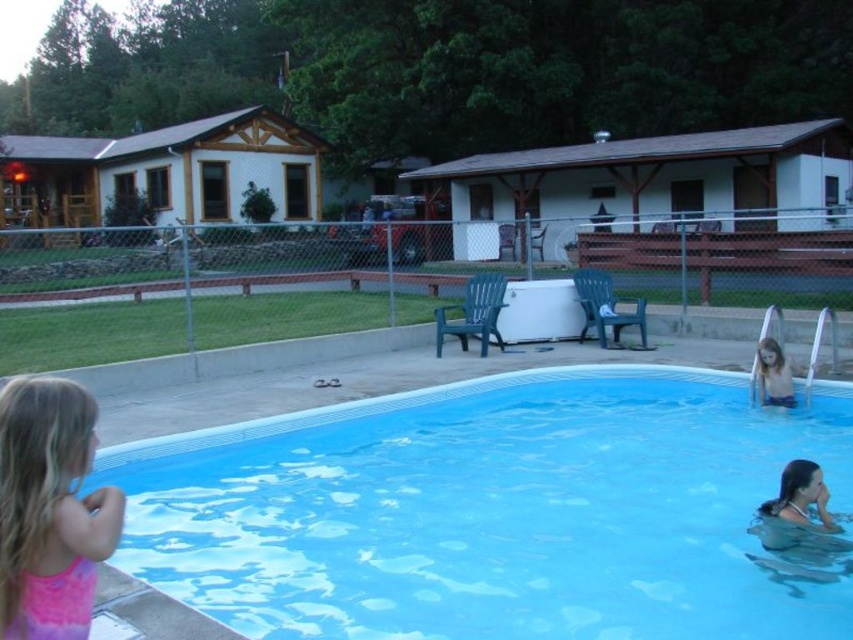
Can you confirm if blue smooth pool at lower center is wider than pink fabric dress at lower left?

Indeed, blue smooth pool at lower center has a greater width compared to pink fabric dress at lower left.

Does blue smooth pool at lower center appear on the right side of pink fabric dress at lower left?

Indeed, blue smooth pool at lower center is positioned on the right side of pink fabric dress at lower left.

Between point (602, 436) and point (59, 637), which one is positioned behind?

The point (602, 436) is behind.

Find the location of a particular element. blue smooth pool at lower center is located at coordinates (489, 512).

Can you confirm if blue smooth pool at lower center is positioned to the right of smooth skin child at lower right?

In fact, blue smooth pool at lower center is to the left of smooth skin child at lower right.

Is point (683, 381) in front of point (780, 387)?

No, (683, 381) is further to viewer.

Locate an element on the screen. This screenshot has height=640, width=853. blue smooth pool at lower center is located at coordinates (489, 512).

Locate an element on the screen. Image resolution: width=853 pixels, height=640 pixels. blue smooth pool at lower center is located at coordinates (489, 512).

Which is more to the left, pink fabric dress at lower left or smooth skin child at lower right?

Positioned to the left is pink fabric dress at lower left.

Does pink fabric dress at lower left have a lesser height compared to smooth skin child at lower right?

In fact, pink fabric dress at lower left may be taller than smooth skin child at lower right.

Does point (20, 522) lie behind point (769, 339)?

No, (20, 522) is in front of (769, 339).

Locate an element on the screen. pink fabric dress at lower left is located at coordinates (49, 509).